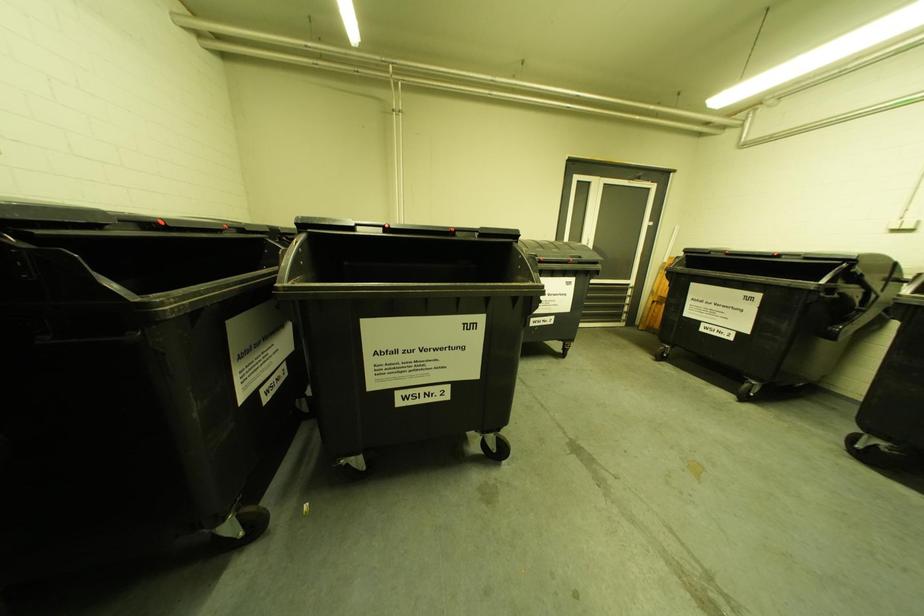
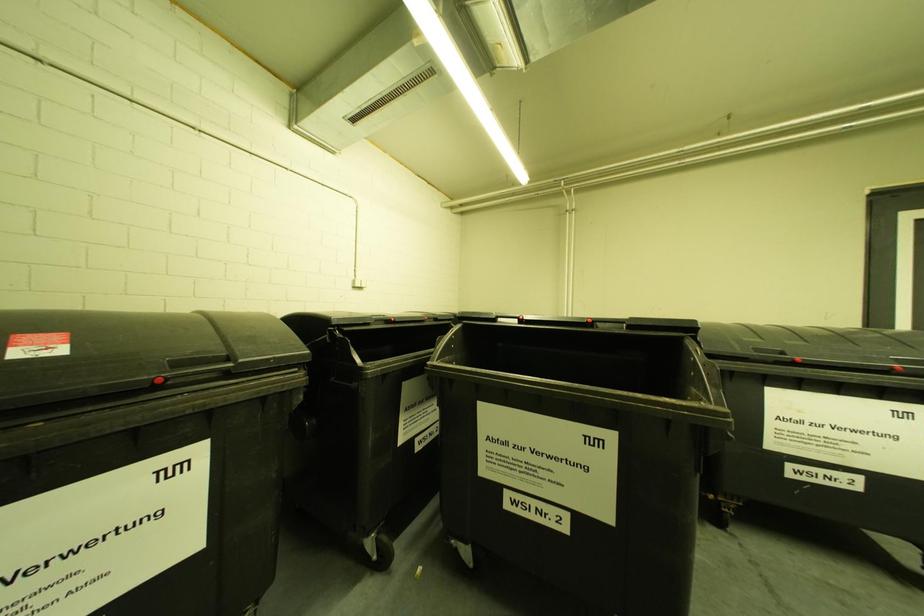
Question: Based on the continuous images, in which direction is the camera rotating? Reply with the corresponding letter.

Choices:
 (A) Left
 (B) Right
 (C) Up
 (D) Down

Answer: (A)